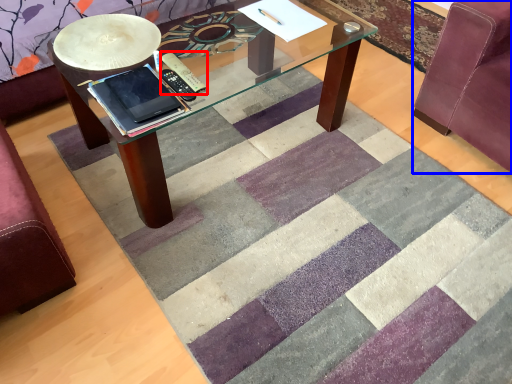
Question: Which object appears farthest to the camera in this image, remote (highlighted by a red box) or swivel chair (highlighted by a blue box)?

Choices:
 (A) remote
 (B) swivel chair

Answer: (A)